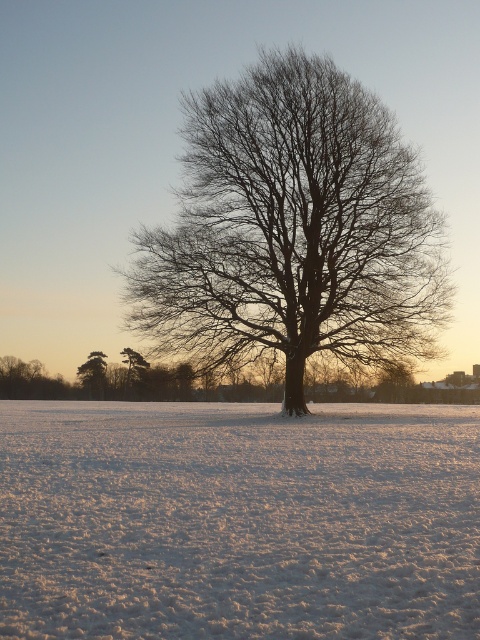
Question: Estimate the real-world distances between objects in this image. Which object is closer to the white fluffy snow at center?

Choices:
 (A) bare branches at center
 (B) green matte tree at left

Answer: (A)

Question: Does green textured pine tree at lower left appear over green matte tree at left?

Choices:
 (A) yes
 (B) no

Answer: (B)

Question: Is bare branches at center wider than green textured pine tree at lower left?

Choices:
 (A) yes
 (B) no

Answer: (A)

Question: Among these points, which one is farthest from the camera?

Choices:
 (A) (323, 292)
 (B) (82, 365)
 (C) (441, 600)
 (D) (126, 355)

Answer: (B)

Question: Can you confirm if white fluffy snow at center is smaller than bare branches at center?

Choices:
 (A) no
 (B) yes

Answer: (B)

Question: Which point is closer to the camera?

Choices:
 (A) (79, 593)
 (B) (287, 368)
 (C) (146, 364)

Answer: (A)